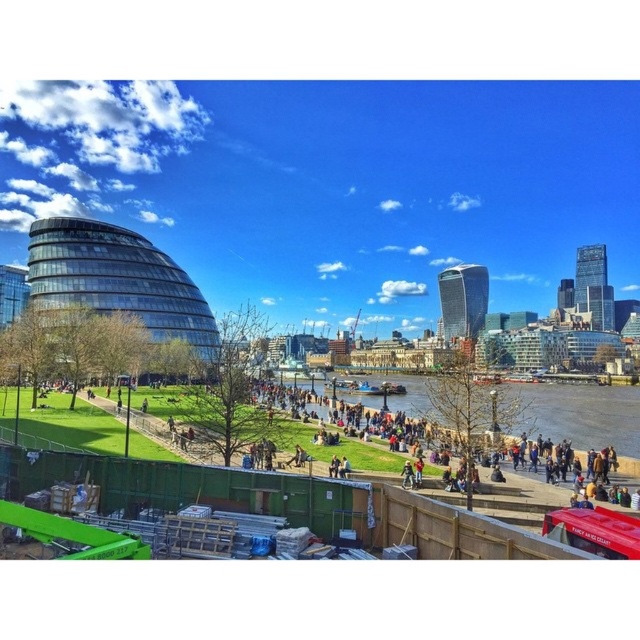
Question: Among these points, which one is farthest from the camera?

Choices:
 (A) (595, 428)
 (B) (476, 544)

Answer: (A)

Question: Which of the following is the farthest from the observer?

Choices:
 (A) brown water at center
 (B) green grass at lower center

Answer: (A)

Question: Is green grass at lower center to the right of brown water at center from the viewer's perspective?

Choices:
 (A) no
 (B) yes

Answer: (A)

Question: Does green grass at lower center lie in front of brown water at center?

Choices:
 (A) yes
 (B) no

Answer: (A)

Question: Can you confirm if green grass at lower center is positioned above brown water at center?

Choices:
 (A) yes
 (B) no

Answer: (B)

Question: Which of the following is the farthest from the observer?

Choices:
 (A) (577, 419)
 (B) (227, 468)

Answer: (A)